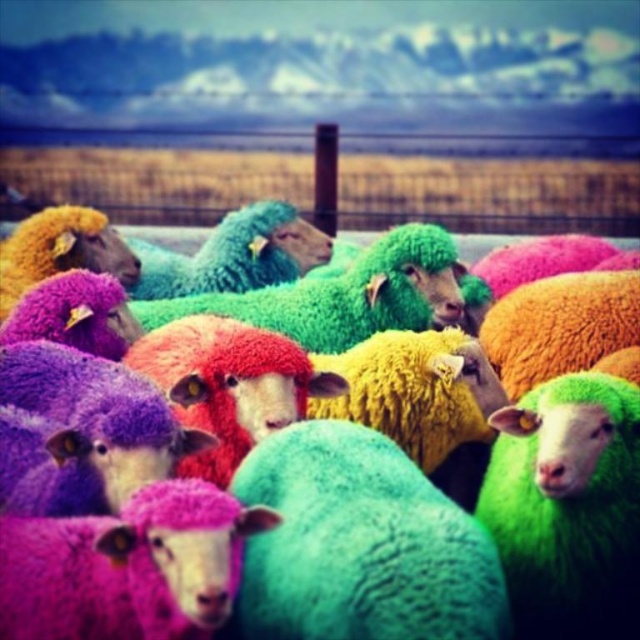
Who is shorter, green fuzzy sheep at center or metallic wire fence at upper center?

Standing shorter between the two is green fuzzy sheep at center.

Find the location of a particular element. This screenshot has height=640, width=640. green fuzzy sheep at center is located at coordinates (529, 420).